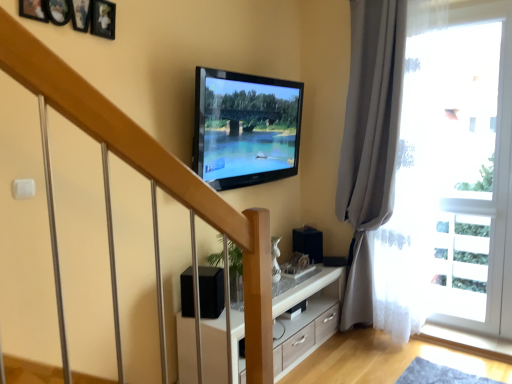
Question: In terms of size, does transparent glass door at right appear bigger or smaller than gray fabric curtain at right?

Choices:
 (A) big
 (B) small

Answer: (B)

Question: Visually, is transparent glass door at right positioned to the left or to the right of gray fabric curtain at right?

Choices:
 (A) left
 (B) right

Answer: (B)

Question: Estimate the real-world distances between objects in this image. Which object is closer to the black matte speaker at lower center?

Choices:
 (A) gray fabric curtain at right
 (B) flat screen tv at upper center
 (C) transparent glass door at right
 (D) white wood cabinet at center

Answer: (D)

Question: Which object is positioned closest to the gray fabric curtain at right?

Choices:
 (A) transparent glass door at right
 (B) flat screen tv at upper center
 (C) black matte speaker at lower center
 (D) white wood cabinet at center

Answer: (A)